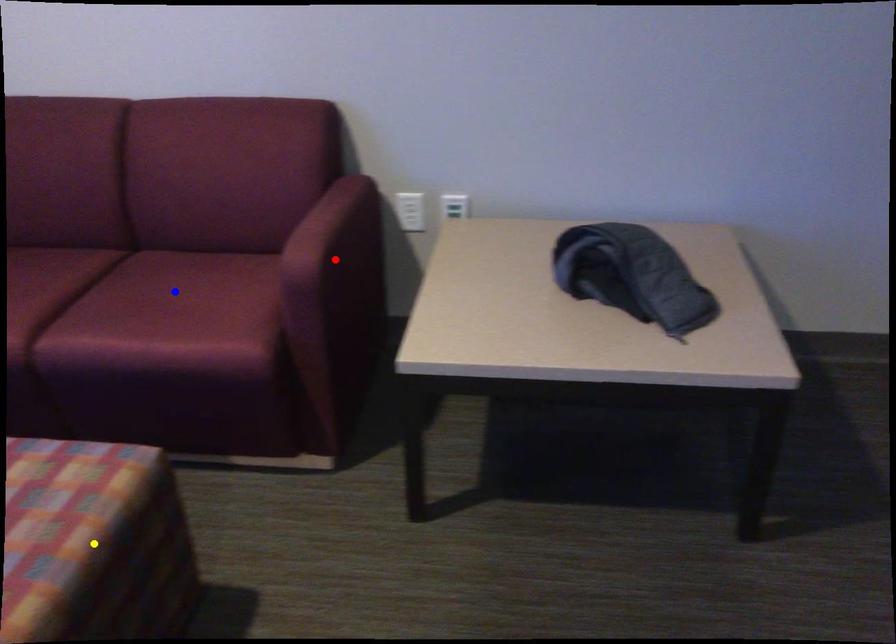
Order these from nearest to farthest:
- red point
- yellow point
- blue point

blue point
red point
yellow point